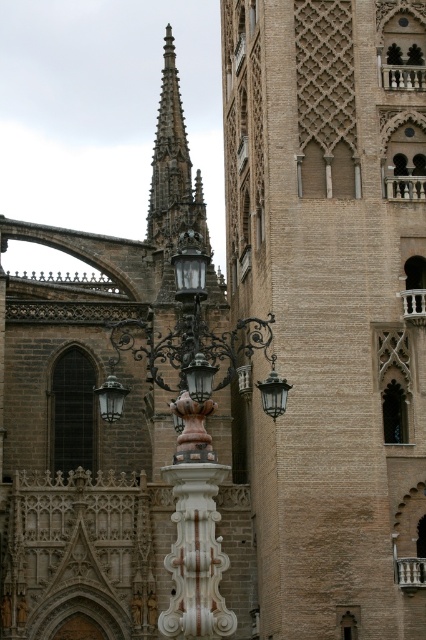
In the scene shown: You are an architect examining the historic building. You notice the white marble column at center and the bronze textured lamp at center. Which object would require a larger base to support its structure?

The white marble column at center requires a larger base because it is larger in size than the bronze textured lamp at center.

Consider the image. You are an architect planning to install a new sculpture between the smooth stone spire at center and the bronze textured lamp at center. The sculpture will be 1.2 meters tall. Will the sculpture be shorter than both objects?

The smooth stone spire at center has a greater height compared to bronze textured lamp at center. Since the sculpture is 1.2 meters tall, it will be shorter than both objects as the spire is taller than the lamp, and the lamp is taller than 1.2 meters.